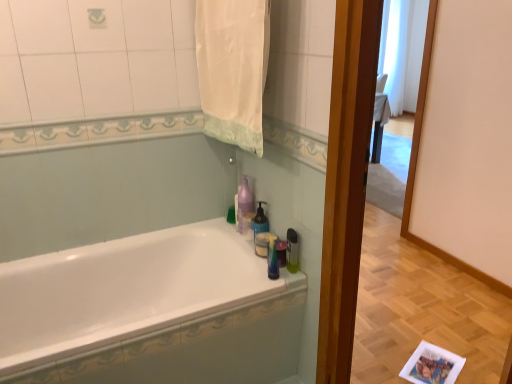
Question: Is translucent plastic soap dispenser at upper center taller or shorter than translucent plastic soap dispenser at right?

Choices:
 (A) short
 (B) tall

Answer: (B)

Question: Is point (266, 225) closer or farther from the camera than point (295, 253)?

Choices:
 (A) farther
 (B) closer

Answer: (A)

Question: Considering the real-world distances, which object is closest to the white glossy bathtub at center?

Choices:
 (A) translucent plastic soap dispenser at right
 (B) translucent plastic soap dispenser at upper center
 (C) purple glossy bottle at upper center
 (D) white fabric towel at upper center

Answer: (C)

Question: Which of these objects is positioned farthest from the translucent plastic soap dispenser at upper center?

Choices:
 (A) white fabric towel at upper center
 (B) white glossy bathtub at center
 (C) translucent plastic soap dispenser at right
 (D) purple glossy bottle at upper center

Answer: (A)